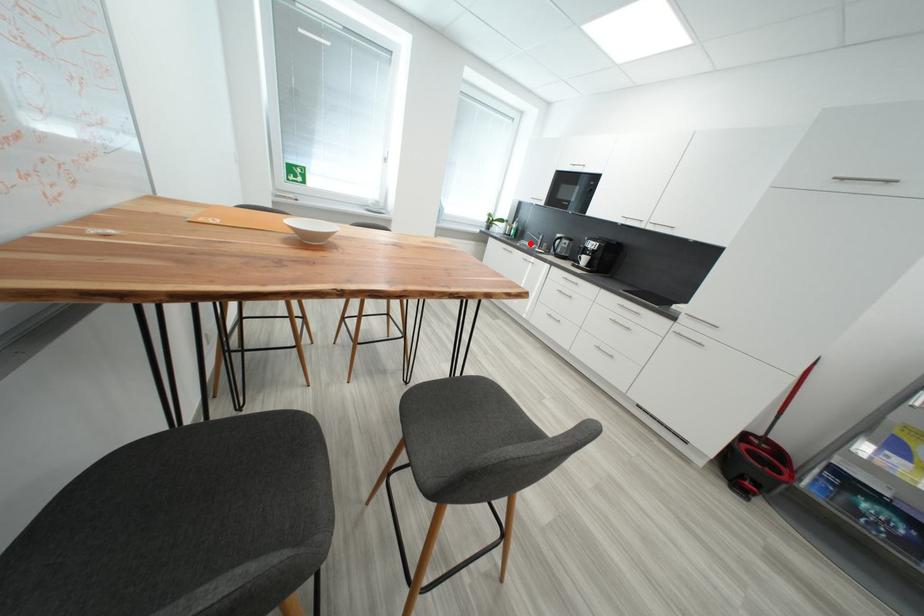
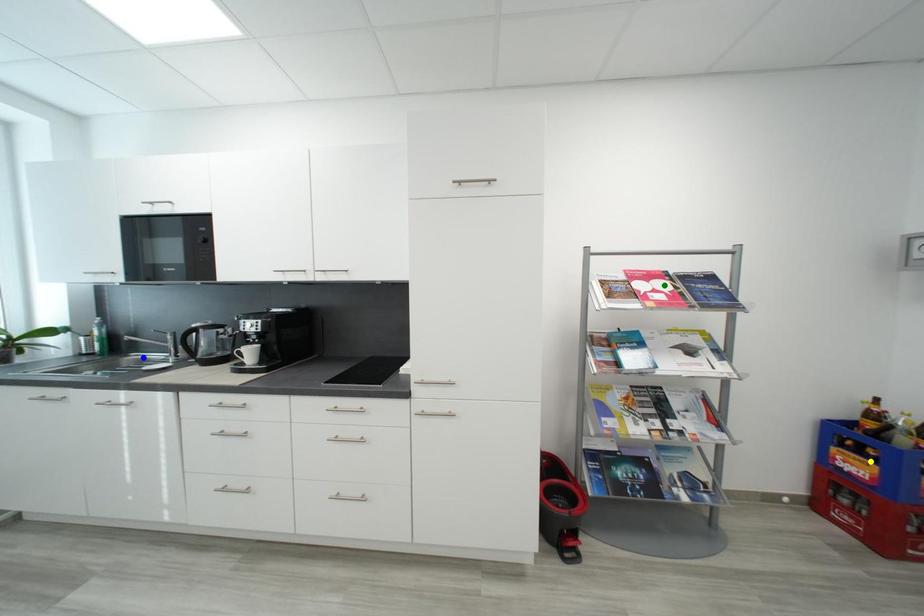
Question: I am providing you with two images of the same scene from different viewpoints. A red point is marked on the first image. You are given multiple points on the second image. In image 2, which mark is for the same physical point as the one in image 1?

Choices:
 (A) blue point
 (B) green point
 (C) yellow point

Answer: (A)